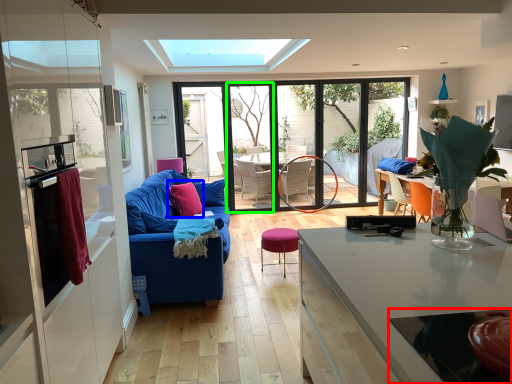
Question: Which object is the farthest from glass table (highlighted by a red box)? Choose among these: throw pillow (highlighted by a blue box) or glass door (highlighted by a green box).

Choices:
 (A) throw pillow
 (B) glass door

Answer: (B)